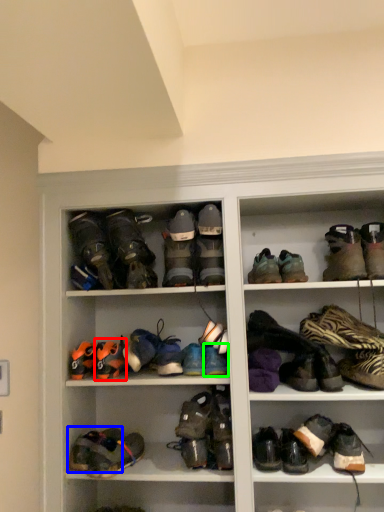
Question: Which is nearer to the footwear (highlighted by a red box)? footwear (highlighted by a blue box) or footwear (highlighted by a green box).

Choices:
 (A) footwear
 (B) footwear

Answer: (A)